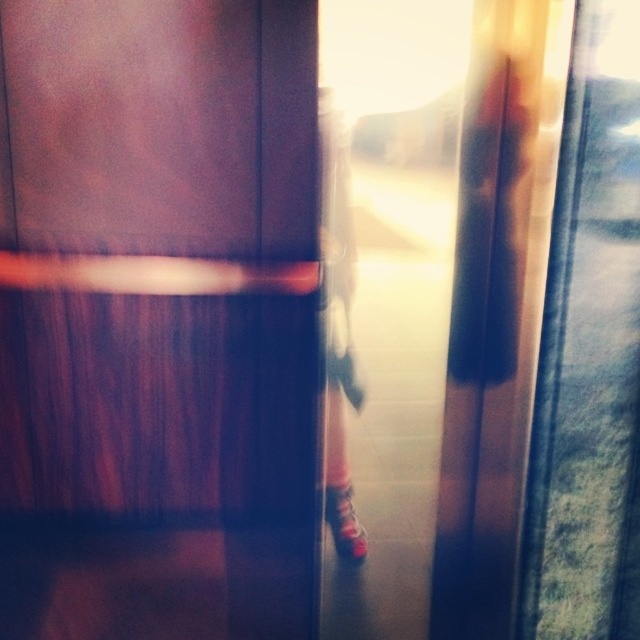
Does wooden elevator door at center appear on the right side of shiny red shoe at center?

No, wooden elevator door at center is not to the right of shiny red shoe at center.

Is wooden elevator door at center wider than shiny red shoe at center?

Indeed, wooden elevator door at center has a greater width compared to shiny red shoe at center.

The image size is (640, 640). What do you see at coordinates (157, 317) in the screenshot?
I see `wooden elevator door at center` at bounding box center [157, 317].

The width and height of the screenshot is (640, 640). Identify the location of wooden elevator door at center. (157, 317).

Can you confirm if wooden elevator door at center is thinner than pink fabric dress at center?

No.

Does wooden elevator door at center appear under pink fabric dress at center?

Yes.

Does point (1, 508) lie behind point (348, 497)?

That is False.

Where is `wooden elevator door at center`? wooden elevator door at center is located at coordinates (157, 317).

Is pink fabric dress at center bigger than shiny red shoe at center?

Yes, pink fabric dress at center is bigger than shiny red shoe at center.

Is point (337, 531) closer to camera compared to point (348, 493)?

No.

Which is behind, point (333, 260) or point (349, 522)?

The point (349, 522) is more distant.

Find the location of a particular element. The width and height of the screenshot is (640, 640). pink fabric dress at center is located at coordinates (332, 336).